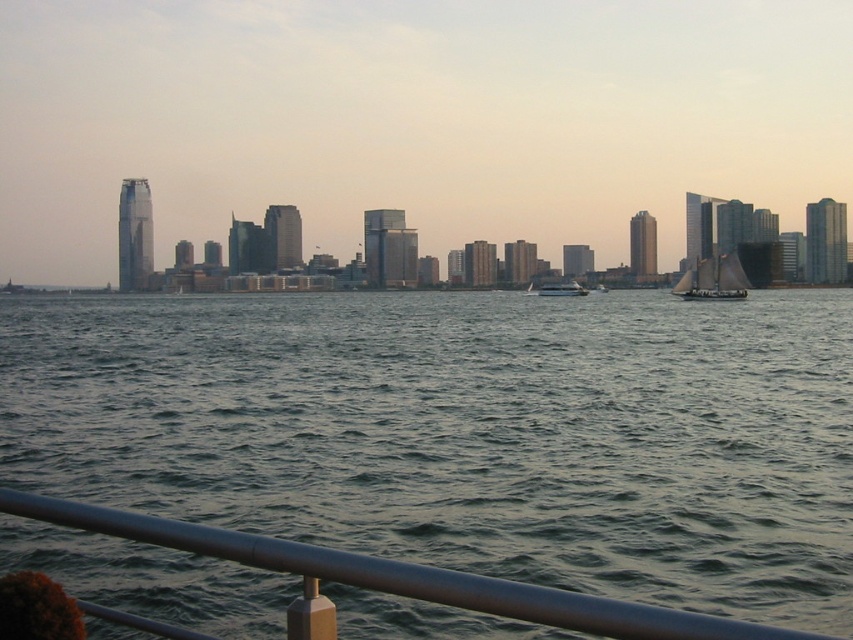
You are standing at the pier and want to board the closest boat. Which boat should you choose between the white sailboat at right and the white glossy boat at center?

The white sailboat at right is closer to you than the white glossy boat at center because it is positioned to the right side of the frame, so you should choose the white sailboat at right.